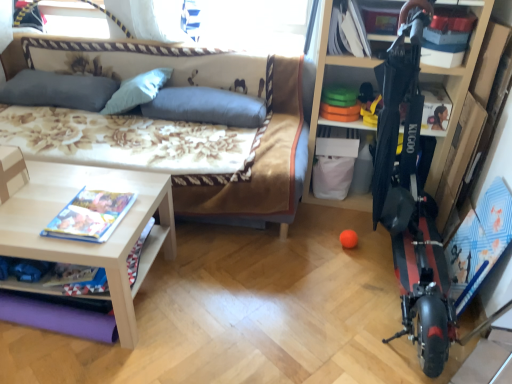
What are the coordinates of `vacant space behind hardcover book at lower left, the first book in the front-to-back sequence` in the screenshot? It's located at (100, 184).